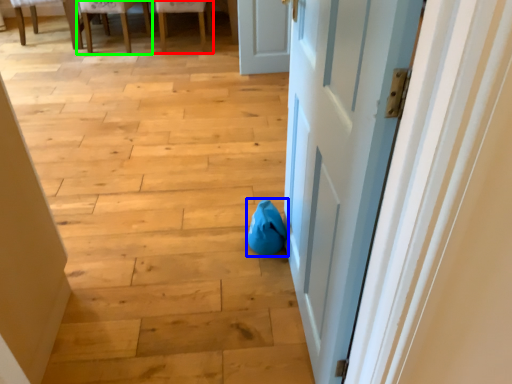
Question: Based on their relative distances, which object is farther from chair (highlighted by a red box)? Choose from bean bag chair (highlighted by a blue box) and chair (highlighted by a green box).

Choices:
 (A) bean bag chair
 (B) chair

Answer: (A)